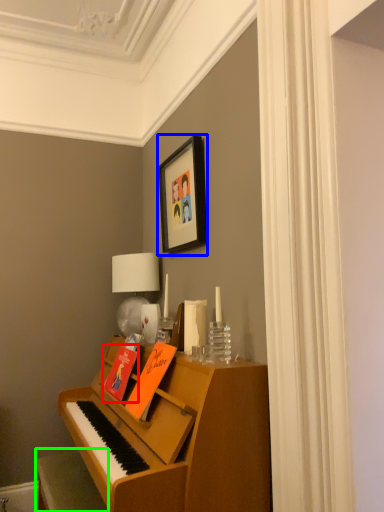
Question: Which object is the farthest from book (highlighted by a red box)? Choose among these: picture frame (highlighted by a blue box) or furniture (highlighted by a green box).

Choices:
 (A) picture frame
 (B) furniture

Answer: (A)